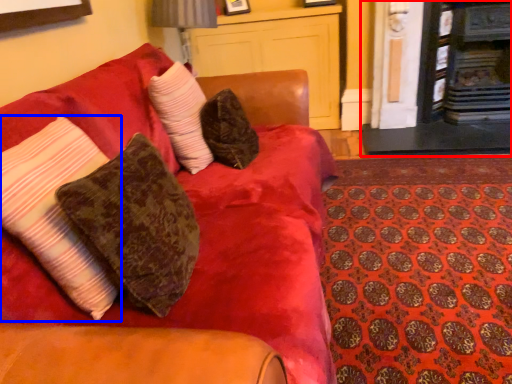
Question: Which object appears farthest to the camera in this image, fireplace (highlighted by a red box) or pillow (highlighted by a blue box)?

Choices:
 (A) fireplace
 (B) pillow

Answer: (A)